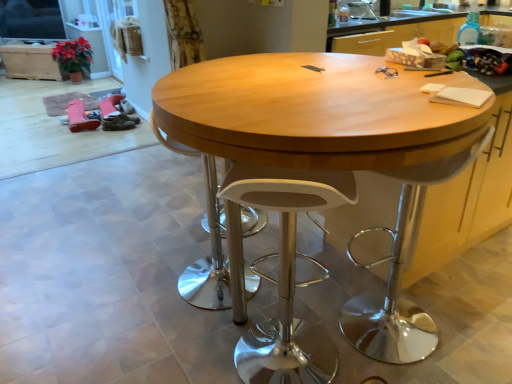
Locate an element on the screen. This screenshot has height=384, width=512. free space that is in between white plastic swivel chair at center, the first swivel chair when ordered from left to right, and white plastic swivel chair at right, which is counted as the 2th swivel chair, starting from the left is located at coordinates (292, 302).